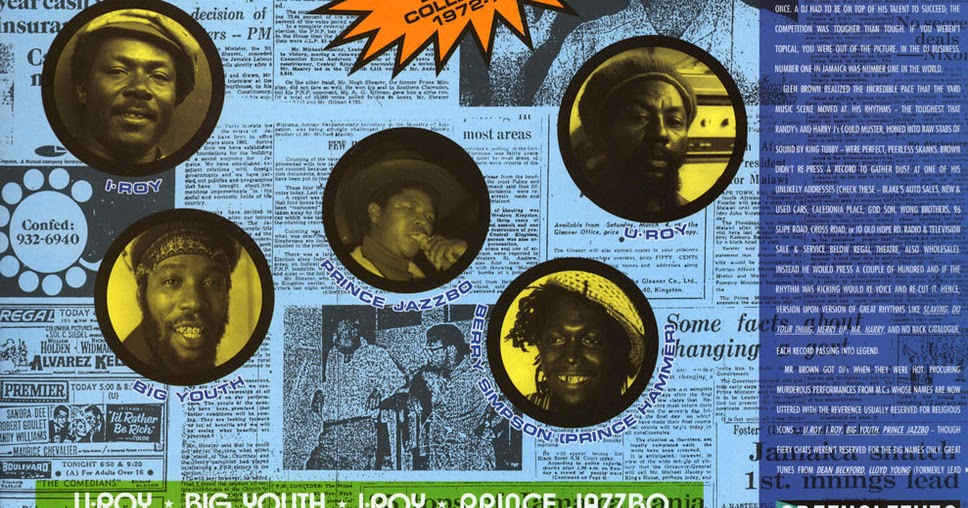
The width and height of the screenshot is (968, 508). Find the location of `newspaper`. newspaper is located at coordinates (485, 75).